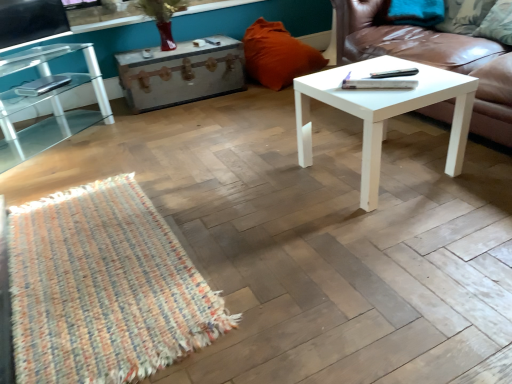
Question: Is clear glass table at left outside of green fabric pillow at upper right, placed as the first pillow when sorted from right to left?

Choices:
 (A) yes
 (B) no

Answer: (A)

Question: Is green fabric pillow at upper right, which appears as the 2th pillow when viewed from the left, located within clear glass table at left?

Choices:
 (A) no
 (B) yes

Answer: (A)

Question: Is clear glass table at left oriented towards green fabric pillow at upper right, placed as the first pillow when sorted from right to left?

Choices:
 (A) yes
 (B) no

Answer: (A)

Question: Does clear glass table at left have a greater height compared to green fabric pillow at upper right, which is counted as the second pillow, starting from the back?

Choices:
 (A) yes
 (B) no

Answer: (A)

Question: Considering the relative sizes of clear glass table at left and green fabric pillow at upper right, which is counted as the second pillow, starting from the back, in the image provided, is clear glass table at left bigger than green fabric pillow at upper right, which is counted as the second pillow, starting from the back,?

Choices:
 (A) yes
 (B) no

Answer: (A)

Question: Can you confirm if clear glass table at left is thinner than green fabric pillow at upper right, which is counted as the second pillow, starting from the back?

Choices:
 (A) yes
 (B) no

Answer: (B)

Question: From the image's perspective, would you say orange fabric pillow at upper center, acting as the 1th pillow starting from the back, is positioned over clear glass table at left?

Choices:
 (A) yes
 (B) no

Answer: (A)

Question: Is orange fabric pillow at upper center, acting as the 1th pillow starting from the back, closer to camera compared to clear glass table at left?

Choices:
 (A) yes
 (B) no

Answer: (B)

Question: Is orange fabric pillow at upper center, which ranks as the 2th pillow in right-to-left order, oriented towards clear glass table at left?

Choices:
 (A) no
 (B) yes

Answer: (A)

Question: Does orange fabric pillow at upper center, the first pillow when ordered from left to right, have a lesser width compared to clear glass table at left?

Choices:
 (A) yes
 (B) no

Answer: (B)

Question: Are orange fabric pillow at upper center, acting as the 1th pillow starting from the back, and clear glass table at left located far from each other?

Choices:
 (A) no
 (B) yes

Answer: (B)

Question: From a real-world perspective, is orange fabric pillow at upper center, the first pillow when ordered from left to right, positioned over clear glass table at left based on gravity?

Choices:
 (A) no
 (B) yes

Answer: (A)

Question: Can you confirm if white leather couch at right is bigger than rustic wood trunk at center?

Choices:
 (A) yes
 (B) no

Answer: (A)